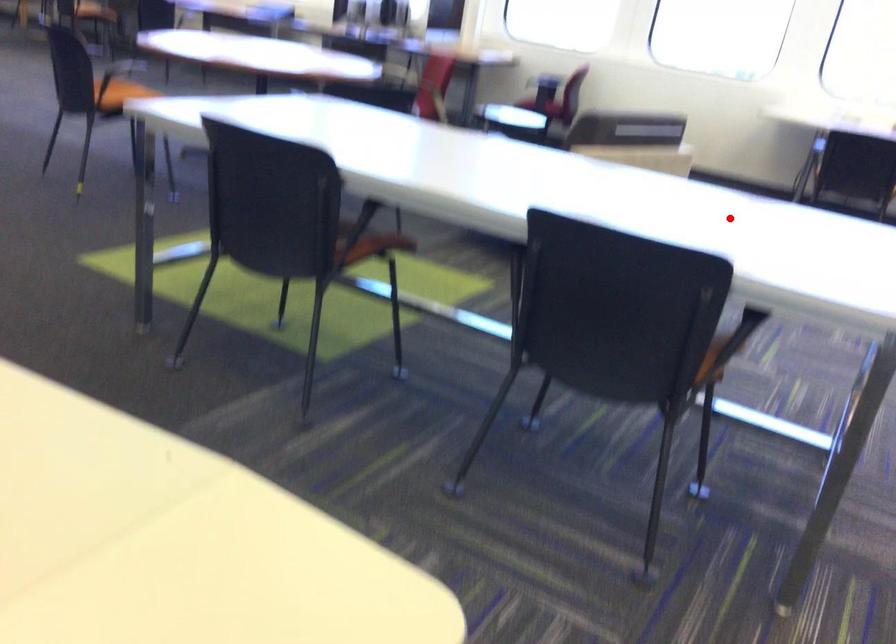
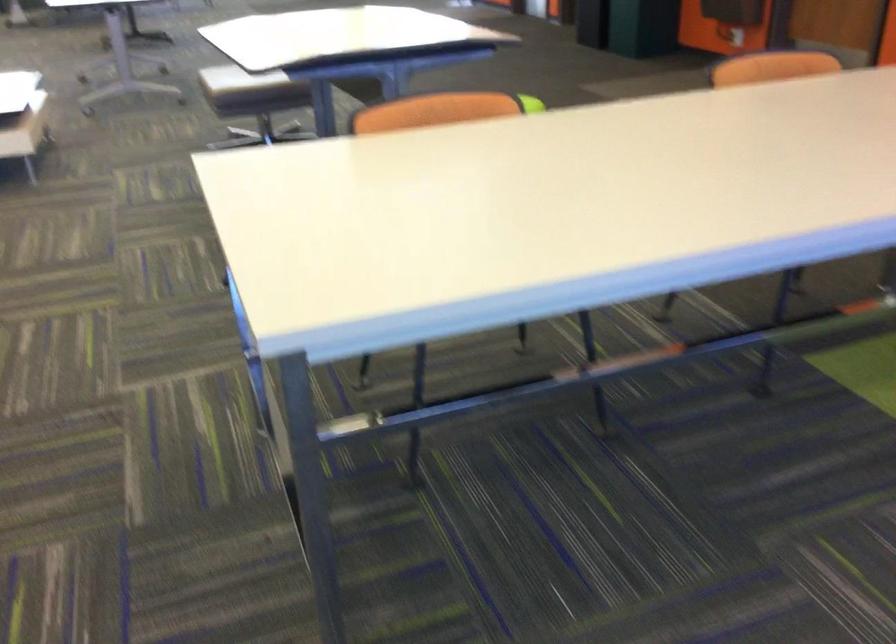
Question: I am providing you with two images of the same scene from different viewpoints. A red point is marked on the first image. At the location where the point appears in image 1, is it still visible in image 2?

Choices:
 (A) Yes
 (B) No

Answer: (A)